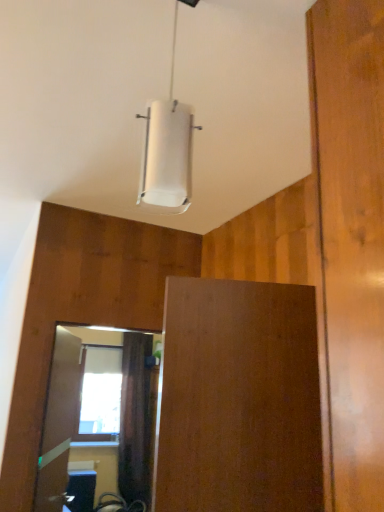
In order to click on white matte rectangular light fixture at upper center in this screenshot , I will do `click(168, 148)`.

Measure the distance between white matte rectangular light fixture at upper center and camera.

The depth of white matte rectangular light fixture at upper center is 31.51 inches.

What do you see at coordinates (168, 148) in the screenshot? I see `white matte rectangular light fixture at upper center` at bounding box center [168, 148].

At what (x,y) coordinates should I click in order to perform the action: click on white matte rectangular light fixture at upper center. Please return your answer as a coordinate pair (x, y). Image resolution: width=384 pixels, height=512 pixels. Looking at the image, I should click on (168, 148).